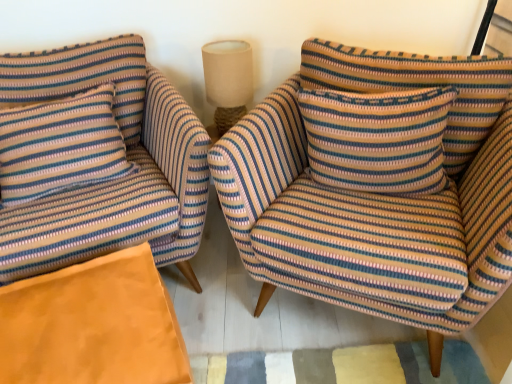
Question: Considering the relative sizes of orange suede ottoman at lower left and striped fabric armchair at center, which is the 2th chair from left to right, in the image provided, is orange suede ottoman at lower left smaller than striped fabric armchair at center, which is the 2th chair from left to right,?

Choices:
 (A) no
 (B) yes

Answer: (B)

Question: Is orange suede ottoman at lower left taller than striped fabric armchair at center, which is the 2th chair from left to right?

Choices:
 (A) yes
 (B) no

Answer: (B)

Question: From a real-world perspective, is orange suede ottoman at lower left beneath striped fabric armchair at center, marked as the 1th chair in a right-to-left arrangement?

Choices:
 (A) yes
 (B) no

Answer: (A)

Question: Can we say orange suede ottoman at lower left lies outside striped fabric armchair at center, marked as the 1th chair in a right-to-left arrangement?

Choices:
 (A) no
 (B) yes

Answer: (B)

Question: From the image's perspective, is orange suede ottoman at lower left over striped fabric armchair at center, which is the 2th chair from left to right?

Choices:
 (A) yes
 (B) no

Answer: (B)

Question: Is striped fabric armchair at left, positioned as the 2th chair in right-to-left order, wider or thinner than beige fabric lampshade at upper center?

Choices:
 (A) wide
 (B) thin

Answer: (A)

Question: Considering the positions of point (112, 190) and point (214, 41), is point (112, 190) closer or farther from the camera than point (214, 41)?

Choices:
 (A) closer
 (B) farther

Answer: (A)

Question: Would you say striped fabric armchair at left, which ranks as the first chair in left-to-right order, is inside or outside beige fabric lampshade at upper center?

Choices:
 (A) inside
 (B) outside

Answer: (B)

Question: From a real-world perspective, is striped fabric armchair at left, which ranks as the first chair in left-to-right order, physically located above or below beige fabric lampshade at upper center?

Choices:
 (A) above
 (B) below

Answer: (B)

Question: Is striped fabric pillow at left, which appears as the second pillow when viewed from the right, to the left or to the right of striped fabric pillow at center, marked as the 1th pillow in a right-to-left arrangement, in the image?

Choices:
 (A) left
 (B) right

Answer: (A)

Question: Is point (95, 135) positioned closer to the camera than point (307, 130)?

Choices:
 (A) closer
 (B) farther

Answer: (B)

Question: From the image's perspective, relative to striped fabric pillow at center, which is the 2th pillow from left to right, is striped fabric pillow at left, which appears as the second pillow when viewed from the right, above or below?

Choices:
 (A) below
 (B) above

Answer: (A)

Question: In terms of height, does striped fabric pillow at left, which appears as the second pillow when viewed from the right, look taller or shorter compared to striped fabric pillow at center, marked as the 1th pillow in a right-to-left arrangement?

Choices:
 (A) tall
 (B) short

Answer: (A)

Question: From a real-world perspective, is striped fabric armchair at left, which ranks as the first chair in left-to-right order, positioned above or below striped fabric pillow at left, positioned as the first pillow in left-to-right order?

Choices:
 (A) above
 (B) below

Answer: (B)

Question: Considering the relative positions of striped fabric armchair at left, which ranks as the first chair in left-to-right order, and striped fabric pillow at left, positioned as the first pillow in left-to-right order, in the image provided, is striped fabric armchair at left, which ranks as the first chair in left-to-right order, to the left or to the right of striped fabric pillow at left, positioned as the first pillow in left-to-right order,?

Choices:
 (A) left
 (B) right

Answer: (B)